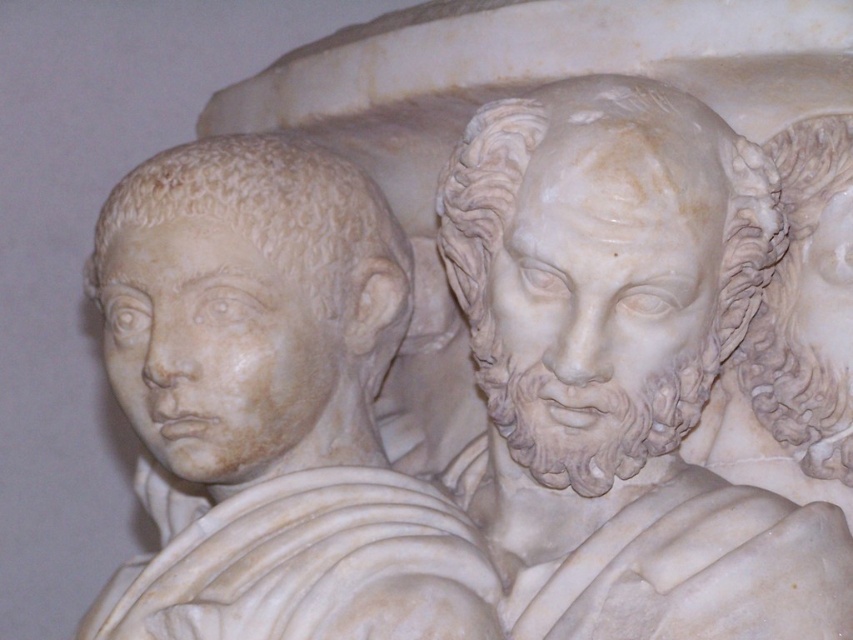
Looking at the marble sculpture, where is the white marble head at left in relation to the white marble hair at upper right?

The white marble head at left is located to the left of the white marble hair at upper right.

You are an art conservator working on a marble sculpture. You need to place a protective cover over both the white marble head at center and the white marble head at left. The cover can only extend 4 inches from the leftmost head. Will the cover reach the center head?

The white marble head at center is 4.39 inches from the white marble head at left. Since the cover can only extend 4 inches from the leftmost head, it will not fully cover the white marble head at center as the distance exceeds the cover capacity.